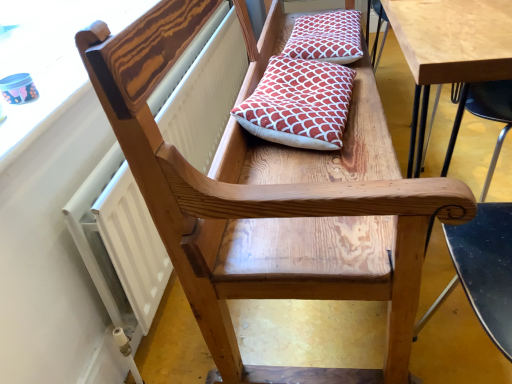
Question: In terms of size, does wooden chair arm at upper left appear bigger or smaller than white textured radiator at upper left?

Choices:
 (A) small
 (B) big

Answer: (A)

Question: Considering the positions of point (56, 36) and point (88, 230), is point (56, 36) closer or farther from the camera than point (88, 230)?

Choices:
 (A) farther
 (B) closer

Answer: (A)

Question: Which of these objects is positioned closest to the red patterned cushion at center, arranged as the 1th pillow when viewed from the front?

Choices:
 (A) red patterned cushion at upper center, the 1th pillow when ordered from back to front
 (B) wooden chair arm at upper left
 (C) white textured radiator at upper left

Answer: (A)

Question: Estimate the real-world distances between objects in this image. Which object is closer to the white textured radiator at upper left?

Choices:
 (A) wooden chair arm at upper left
 (B) red patterned cushion at upper center, the 1th pillow when ordered from back to front
 (C) red patterned cushion at center, the first pillow positioned from the bottom

Answer: (A)